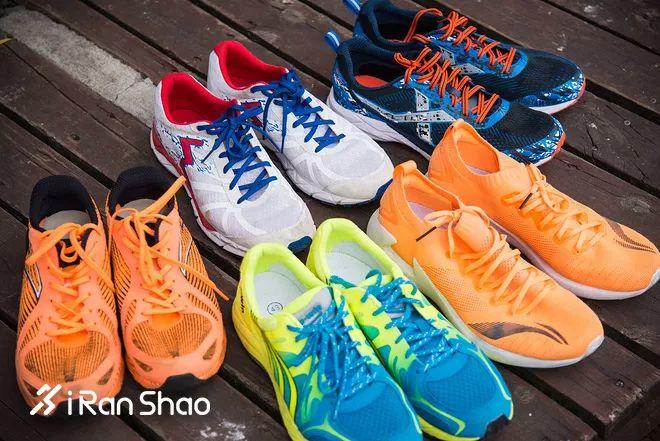
This screenshot has height=441, width=660. In order to click on wooden planks in this screenshot , I will do `click(637, 21)`, `click(606, 53)`, `click(602, 152)`, `click(591, 181)`, `click(630, 328)`, `click(608, 384)`, `click(541, 421)`, `click(251, 374)`, `click(220, 405)`, `click(102, 430)`.